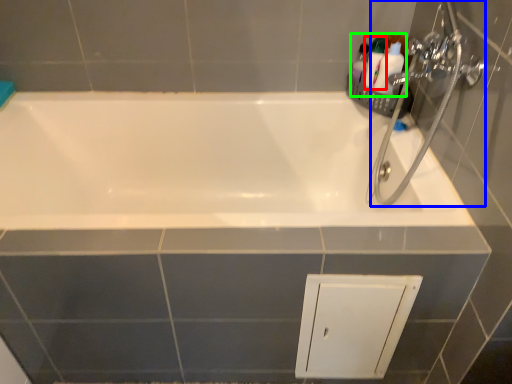
Question: Estimate the real-world distances between objects in this image. Which object is farther from toiletry (highlighted by a red box), plumbing fixture (highlighted by a blue box) or toiletry (highlighted by a green box)?

Choices:
 (A) plumbing fixture
 (B) toiletry

Answer: (A)